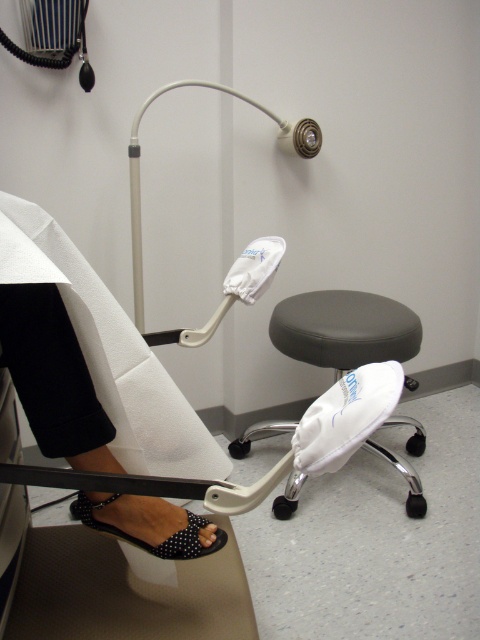
Question: Does white fabric leg at lower left have a smaller size compared to black leather stool at center?

Choices:
 (A) no
 (B) yes

Answer: (A)

Question: Which object is the closest to the black dotted fabric sandal at lower left?

Choices:
 (A) black leather stool at center
 (B) white fabric leg at lower left

Answer: (B)

Question: Is white fabric leg at lower left above black leather stool at center?

Choices:
 (A) no
 (B) yes

Answer: (A)

Question: Which object is closer to the camera taking this photo?

Choices:
 (A) white fabric leg at lower left
 (B) black dotted fabric sandal at lower left

Answer: (A)

Question: Can you confirm if white fabric leg at lower left is positioned to the left of black dotted fabric sandal at lower left?

Choices:
 (A) no
 (B) yes

Answer: (B)

Question: Which object is the closest to the white fabric leg at lower left?

Choices:
 (A) black leather stool at center
 (B) black dotted fabric sandal at lower left

Answer: (B)